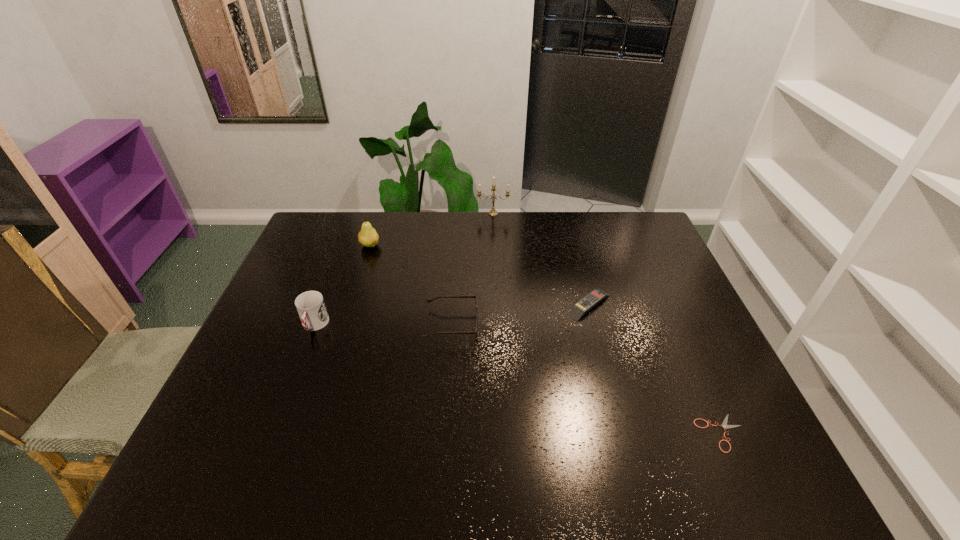
The height and width of the screenshot is (540, 960). What are the coordinates of `vacant space that is in between the shortest object and the fifth nearest object` in the screenshot? It's located at (545, 339).

Locate an element on the screen. vacant area that lies between the nearest object and the third shortest object is located at coordinates (587, 379).

Find the location of a particular element. vacant space that's between the farthest object and the cup is located at coordinates 404,269.

The width and height of the screenshot is (960, 540). In order to click on vacant area between the farthest object and the pear in this screenshot , I will do `click(432, 230)`.

Find the location of a particular element. vacant area between the tallest object and the fifth shortest object is located at coordinates (432, 230).

This screenshot has height=540, width=960. Find the location of `vacant region between the fifth object from right to left and the second object from right to left`. vacant region between the fifth object from right to left and the second object from right to left is located at coordinates click(479, 275).

Identify the location of empty location between the candle and the leftmost object. The height and width of the screenshot is (540, 960). (404, 269).

You are a GUI agent. You are given a task and a screenshot of the screen. Output one action in this format:
    pyautogui.click(x=<x>, y=<y>)
    Task: Click on the empty space between the leftmost object and the second farthest object
    This screenshot has height=540, width=960.
    Given the screenshot: What is the action you would take?
    coord(342,285)

Where is `free space between the shears and the pear`? The height and width of the screenshot is (540, 960). free space between the shears and the pear is located at coordinates (545, 339).

The height and width of the screenshot is (540, 960). Find the location of `the closest object relative to the third shortest object`. the closest object relative to the third shortest object is located at coordinates [596, 296].